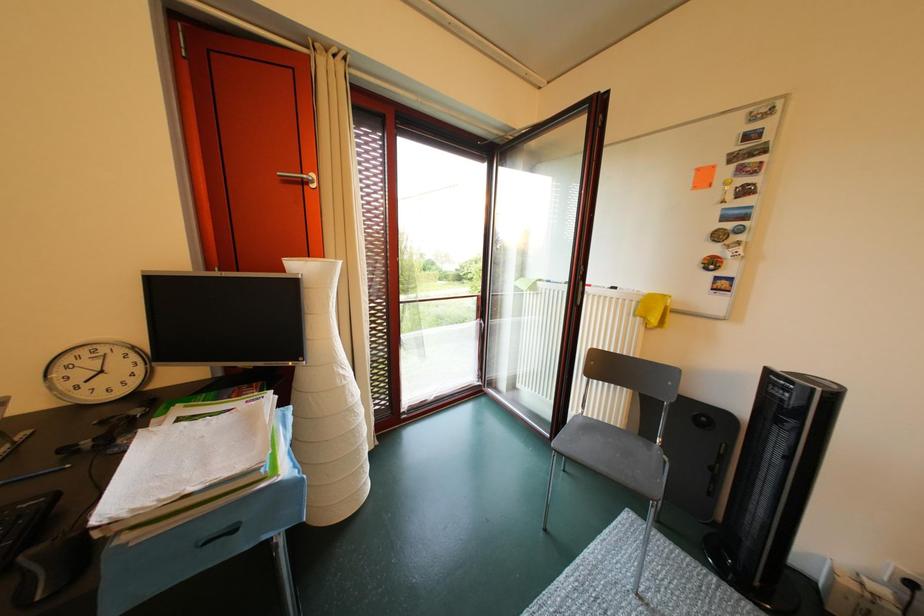
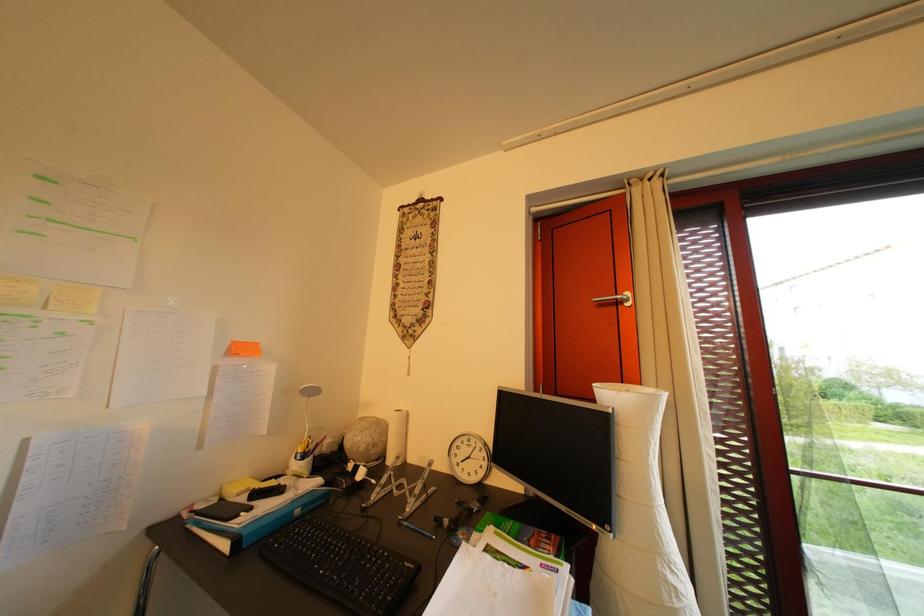
The images are taken continuously from a first-person perspective. In which direction is your viewpoint rotating?

The rotation direction of the camera is left-up.